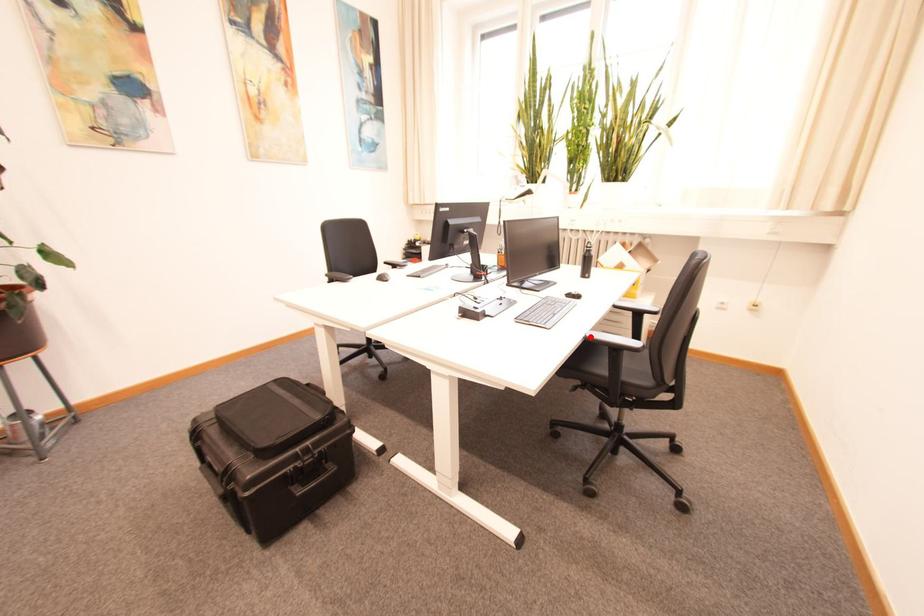
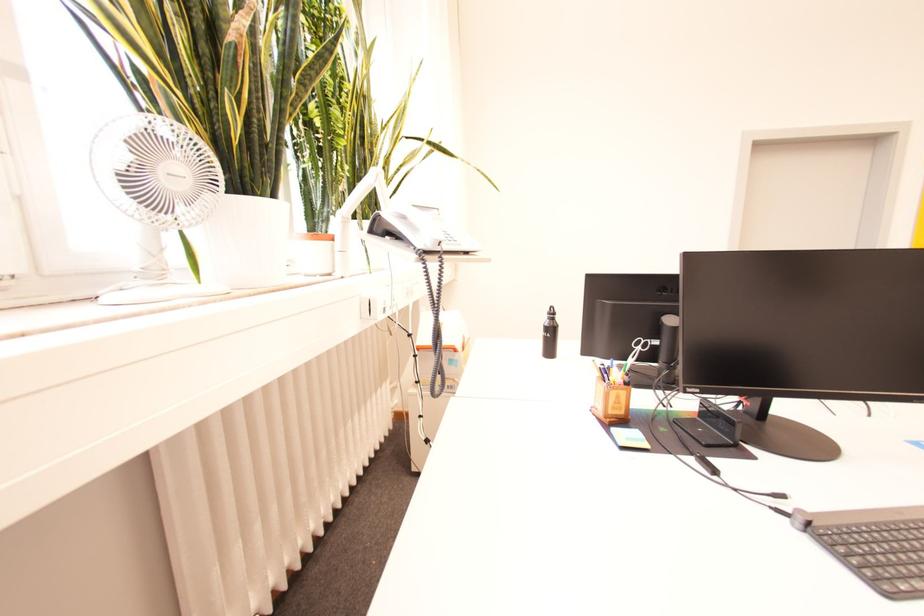
Question: I am providing you with two images of the same scene from different viewpoints. A red point is marked on the first image. At the location where the point appears in image 1, is it still visible in image 2?

Choices:
 (A) Yes
 (B) No

Answer: (B)